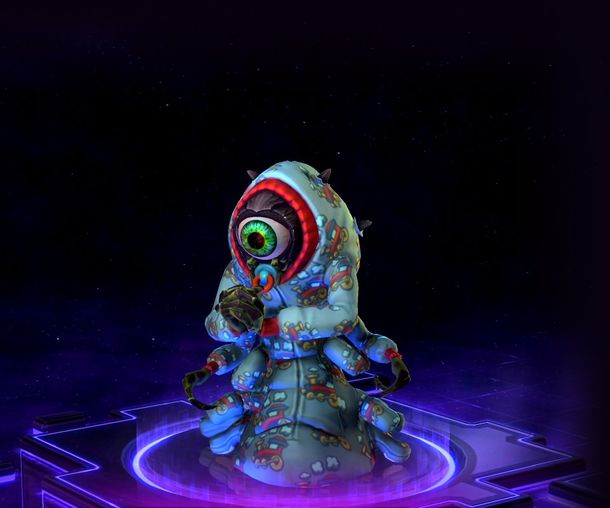
The width and height of the screenshot is (610, 508). I want to click on hood, so click(288, 186).